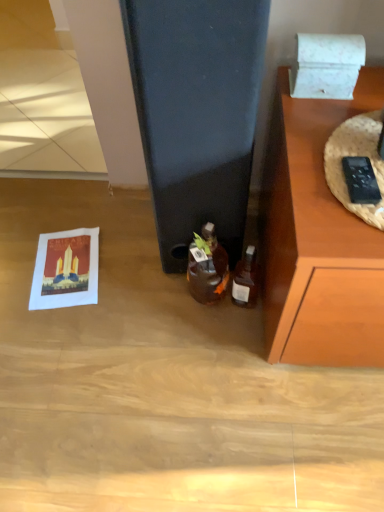
Question: From their relative heights in the image, would you say matte paper postcard at lower left is taller or shorter than white marble box at upper right?

Choices:
 (A) short
 (B) tall

Answer: (A)

Question: From the image's perspective, is matte paper postcard at lower left located above or below white marble box at upper right?

Choices:
 (A) above
 (B) below

Answer: (B)

Question: Considering the real-world distances, which object is closest to the matte paper postcard at lower left?

Choices:
 (A) black plastic remote control at right
 (B) translucent glass bottle at center, marked as the second bottle in a right-to-left arrangement
 (C) white marble box at upper right
 (D) translucent glass bottle at lower right, which ranks as the 1th bottle in right-to-left order

Answer: (B)

Question: Considering the real-world distances, which object is farthest from the translucent glass bottle at center, positioned as the 1th bottle in left-to-right order?

Choices:
 (A) matte paper postcard at lower left
 (B) white marble box at upper right
 (C) translucent glass bottle at lower right, which ranks as the 1th bottle in right-to-left order
 (D) black plastic remote control at right

Answer: (D)